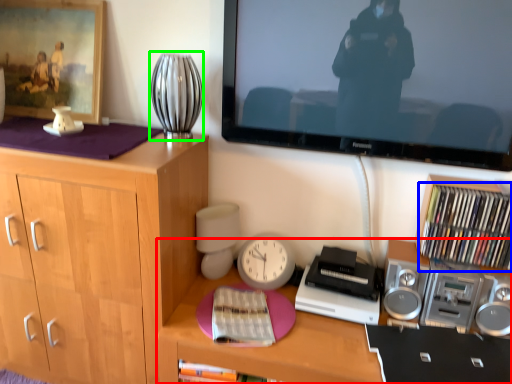
Question: Which object is the closest to the desk (highlighted by a red box)? Choose among these: book (highlighted by a blue box) or table lamp (highlighted by a green box).

Choices:
 (A) book
 (B) table lamp

Answer: (A)